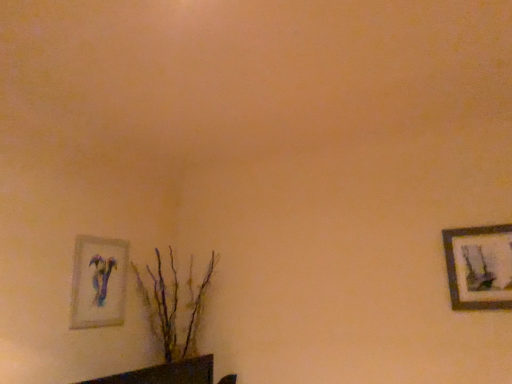
The width and height of the screenshot is (512, 384). Describe the element at coordinates (173, 306) in the screenshot. I see `brown textured plant at lower left` at that location.

In order to face wooden framed artwork at right, which is counted as the first picture frame, starting from the right, should I rotate leftwards or rightwards?

To face it directly, rotate right by 30.263 degrees.

Where is `wooden framed artwork at right, which is the 2th picture frame from left to right`? This screenshot has height=384, width=512. wooden framed artwork at right, which is the 2th picture frame from left to right is located at coordinates (479, 267).

The width and height of the screenshot is (512, 384). Find the location of `brown textured plant at lower left`. brown textured plant at lower left is located at coordinates (173, 306).

Considering the positions of objects matte glass picture frame at lower left, the second picture frame viewed from the right, and wooden framed artwork at right, which is counted as the first picture frame, starting from the right, in the image provided, who is more to the left, matte glass picture frame at lower left, the second picture frame viewed from the right, or wooden framed artwork at right, which is counted as the first picture frame, starting from the right,?

matte glass picture frame at lower left, the second picture frame viewed from the right.

From a real-world perspective, is matte glass picture frame at lower left, the second picture frame viewed from the right, over wooden framed artwork at right, which is the 2th picture frame from left to right?

No, from a real-world perspective, matte glass picture frame at lower left, the second picture frame viewed from the right, is not above wooden framed artwork at right, which is the 2th picture frame from left to right.

Which of these two, matte glass picture frame at lower left, placed as the first picture frame when sorted from left to right, or wooden framed artwork at right, which is the 2th picture frame from left to right, is wider?

Wider between the two is wooden framed artwork at right, which is the 2th picture frame from left to right.

Does matte glass picture frame at lower left, the second picture frame viewed from the right, come behind brown textured plant at lower left?

No, matte glass picture frame at lower left, the second picture frame viewed from the right, is in front of brown textured plant at lower left.

From a real-world perspective, between matte glass picture frame at lower left, placed as the first picture frame when sorted from left to right, and brown textured plant at lower left, who is vertically higher?

In real-world perspective, matte glass picture frame at lower left, placed as the first picture frame when sorted from left to right, is above.

Find the location of a particular element. houseplant that appears on the right of matte glass picture frame at lower left, the second picture frame viewed from the right is located at coordinates point(173,306).

From the image's perspective, which one is positioned higher, matte glass picture frame at lower left, placed as the first picture frame when sorted from left to right, or brown textured plant at lower left?

matte glass picture frame at lower left, placed as the first picture frame when sorted from left to right.

Does wooden framed artwork at right, which is the 2th picture frame from left to right, appear on the left side of matte glass picture frame at lower left, the second picture frame viewed from the right?

No.

Could you tell me if wooden framed artwork at right, which is counted as the first picture frame, starting from the right, is turned towards matte glass picture frame at lower left, the second picture frame viewed from the right?

No, wooden framed artwork at right, which is counted as the first picture frame, starting from the right, is not oriented towards matte glass picture frame at lower left, the second picture frame viewed from the right.

Considering the points (459, 298) and (126, 273), which point is in front, point (459, 298) or point (126, 273)?

Positioned in front is point (459, 298).

From a real-world perspective, between wooden framed artwork at right, which is the 2th picture frame from left to right, and matte glass picture frame at lower left, the second picture frame viewed from the right, who is vertically lower?

matte glass picture frame at lower left, the second picture frame viewed from the right.

Is there a large distance between brown textured plant at lower left and wooden framed artwork at right, which is counted as the first picture frame, starting from the right?

Yes.

Considering their positions, is brown textured plant at lower left located in front of or behind wooden framed artwork at right, which is counted as the first picture frame, starting from the right?

In the image, brown textured plant at lower left appears behind wooden framed artwork at right, which is counted as the first picture frame, starting from the right.

In order to click on houseplant on the left of wooden framed artwork at right, which is counted as the first picture frame, starting from the right in this screenshot , I will do `click(173, 306)`.

Is brown textured plant at lower left taller than wooden framed artwork at right, which is counted as the first picture frame, starting from the right?

Correct, brown textured plant at lower left is much taller as wooden framed artwork at right, which is counted as the first picture frame, starting from the right.

Could you tell me if brown textured plant at lower left is facing matte glass picture frame at lower left, the second picture frame viewed from the right?

No, brown textured plant at lower left is not aimed at matte glass picture frame at lower left, the second picture frame viewed from the right.

From the image's perspective, is brown textured plant at lower left below matte glass picture frame at lower left, placed as the first picture frame when sorted from left to right?

Yes, from the image's perspective, brown textured plant at lower left is beneath matte glass picture frame at lower left, placed as the first picture frame when sorted from left to right.

Is brown textured plant at lower left outside of matte glass picture frame at lower left, the second picture frame viewed from the right?

Yes, brown textured plant at lower left is located beyond the bounds of matte glass picture frame at lower left, the second picture frame viewed from the right.

Looking at their sizes, would you say brown textured plant at lower left is wider or thinner than matte glass picture frame at lower left, placed as the first picture frame when sorted from left to right?

Considering their sizes, brown textured plant at lower left looks broader than matte glass picture frame at lower left, placed as the first picture frame when sorted from left to right.

How different are the orientations of wooden framed artwork at right, which is the 2th picture frame from left to right, and brown textured plant at lower left in degrees?

The angle between the facing direction of wooden framed artwork at right, which is the 2th picture frame from left to right, and the facing direction of brown textured plant at lower left is 91 degrees.

Is brown textured plant at lower left surrounded by wooden framed artwork at right, which is the 2th picture frame from left to right?

Definitely not — brown textured plant at lower left is not inside wooden framed artwork at right, which is the 2th picture frame from left to right.

From the picture: Which point is more forward, (457, 283) or (152, 301)?

The point (457, 283) is closer.

Considering the sizes of objects wooden framed artwork at right, which is the 2th picture frame from left to right, and brown textured plant at lower left in the image provided, who is thinner, wooden framed artwork at right, which is the 2th picture frame from left to right, or brown textured plant at lower left?

wooden framed artwork at right, which is the 2th picture frame from left to right, is thinner.

Where is `picture frame below the wooden framed artwork at right, which is the 2th picture frame from left to right (from a real-world perspective)`? picture frame below the wooden framed artwork at right, which is the 2th picture frame from left to right (from a real-world perspective) is located at coordinates pos(98,282).

Where is `houseplant behind the matte glass picture frame at lower left, the second picture frame viewed from the right`? The height and width of the screenshot is (384, 512). houseplant behind the matte glass picture frame at lower left, the second picture frame viewed from the right is located at coordinates (173, 306).

Based on their spatial positions, is brown textured plant at lower left or matte glass picture frame at lower left, placed as the first picture frame when sorted from left to right, closer to wooden framed artwork at right, which is the 2th picture frame from left to right?

brown textured plant at lower left.

Based on their spatial positions, is matte glass picture frame at lower left, the second picture frame viewed from the right, or wooden framed artwork at right, which is the 2th picture frame from left to right, further from brown textured plant at lower left?

wooden framed artwork at right, which is the 2th picture frame from left to right.

Based on their spatial positions, is matte glass picture frame at lower left, placed as the first picture frame when sorted from left to right, or brown textured plant at lower left closer to wooden framed artwork at right, which is the 2th picture frame from left to right?

Based on the image, brown textured plant at lower left appears to be nearer to wooden framed artwork at right, which is the 2th picture frame from left to right.

Looking at this image, based on their spatial positions, is brown textured plant at lower left or wooden framed artwork at right, which is the 2th picture frame from left to right, further from matte glass picture frame at lower left, placed as the first picture frame when sorted from left to right?

wooden framed artwork at right, which is the 2th picture frame from left to right, lies further to matte glass picture frame at lower left, placed as the first picture frame when sorted from left to right, than the other object.

Looking at the image, which one is located closer to brown textured plant at lower left, wooden framed artwork at right, which is the 2th picture frame from left to right, or matte glass picture frame at lower left, placed as the first picture frame when sorted from left to right?

Among the two, matte glass picture frame at lower left, placed as the first picture frame when sorted from left to right, is located nearer to brown textured plant at lower left.

Which object lies nearer to the anchor point matte glass picture frame at lower left, the second picture frame viewed from the right, wooden framed artwork at right, which is the 2th picture frame from left to right, or brown textured plant at lower left?

brown textured plant at lower left is closer to matte glass picture frame at lower left, the second picture frame viewed from the right.

At what (x,y) coordinates should I click in order to perform the action: click on houseplant situated between matte glass picture frame at lower left, the second picture frame viewed from the right, and wooden framed artwork at right, which is counted as the first picture frame, starting from the right, from left to right. Please return your answer as a coordinate pair (x, y). This screenshot has height=384, width=512. Looking at the image, I should click on (173, 306).